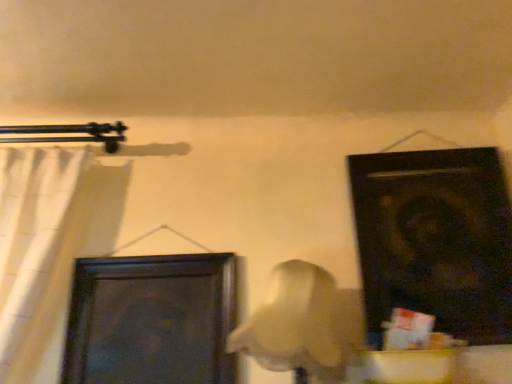
Question: Is dark wood door at center-left, the first door viewed from the left, wider than black matte door at upper right, the 1th door positioned from the right?

Choices:
 (A) no
 (B) yes

Answer: (A)

Question: From a real-world perspective, is dark wood door at center-left, which is the second door from right to left, located higher than black matte door at upper right, the 1th door positioned from the right?

Choices:
 (A) no
 (B) yes

Answer: (A)

Question: Considering the relative positions of dark wood door at center-left, which is the second door from right to left, and black matte door at upper right, the 1th door positioned from the right, in the image provided, is dark wood door at center-left, which is the second door from right to left, to the left of black matte door at upper right, the 1th door positioned from the right, from the viewer's perspective?

Choices:
 (A) no
 (B) yes

Answer: (B)

Question: Is dark wood door at center-left, which is the second door from right to left, located outside black matte door at upper right, acting as the 2th door starting from the left?

Choices:
 (A) no
 (B) yes

Answer: (B)

Question: From the image's perspective, is dark wood door at center-left, the first door viewed from the left, located above black matte door at upper right, the 1th door positioned from the right?

Choices:
 (A) no
 (B) yes

Answer: (A)

Question: Relative to black matte door at upper right, the 1th door positioned from the right, is dark wood door at center-left, which is the second door from right to left, in front or behind?

Choices:
 (A) behind
 (B) front

Answer: (A)

Question: Choose the correct answer: Is dark wood door at center-left, which is the second door from right to left, inside black matte door at upper right, the 1th door positioned from the right, or outside it?

Choices:
 (A) inside
 (B) outside

Answer: (B)

Question: Considering the relative positions of dark wood door at center-left, which is the second door from right to left, and black matte door at upper right, the 1th door positioned from the right, in the image provided, is dark wood door at center-left, which is the second door from right to left, to the left or to the right of black matte door at upper right, the 1th door positioned from the right,?

Choices:
 (A) left
 (B) right

Answer: (A)

Question: In terms of height, does dark wood door at center-left, which is the second door from right to left, look taller or shorter compared to black matte door at upper right, acting as the 2th door starting from the left?

Choices:
 (A) tall
 (B) short

Answer: (B)

Question: Is black matte door at upper right, acting as the 2th door starting from the left, bigger or smaller than dark wood door at center-left, the first door viewed from the left?

Choices:
 (A) big
 (B) small

Answer: (A)

Question: Would you say black matte door at upper right, acting as the 2th door starting from the left, is to the left or to the right of dark wood door at center-left, the first door viewed from the left, in the picture?

Choices:
 (A) right
 (B) left

Answer: (A)

Question: From their relative heights in the image, would you say black matte door at upper right, the 1th door positioned from the right, is taller or shorter than dark wood door at center-left, the first door viewed from the left?

Choices:
 (A) short
 (B) tall

Answer: (B)

Question: Considering the positions of point (373, 261) and point (84, 263), is point (373, 261) closer or farther from the camera than point (84, 263)?

Choices:
 (A) farther
 (B) closer

Answer: (B)

Question: In terms of size, does black matte door at upper right, acting as the 2th door starting from the left, appear bigger or smaller than white fabric curtain at left?

Choices:
 (A) small
 (B) big

Answer: (B)

Question: In terms of width, does black matte door at upper right, the 1th door positioned from the right, look wider or thinner when compared to white fabric curtain at left?

Choices:
 (A) wide
 (B) thin

Answer: (B)